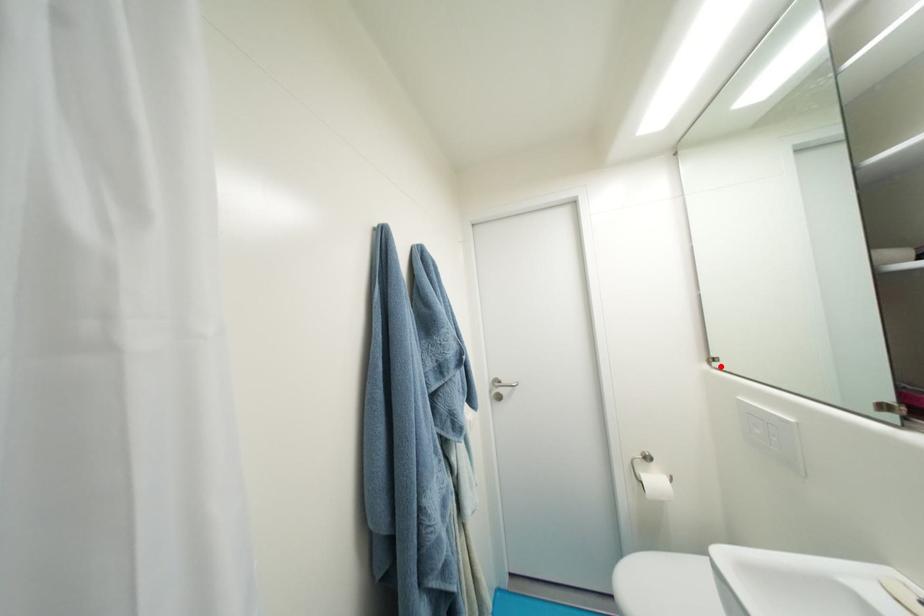
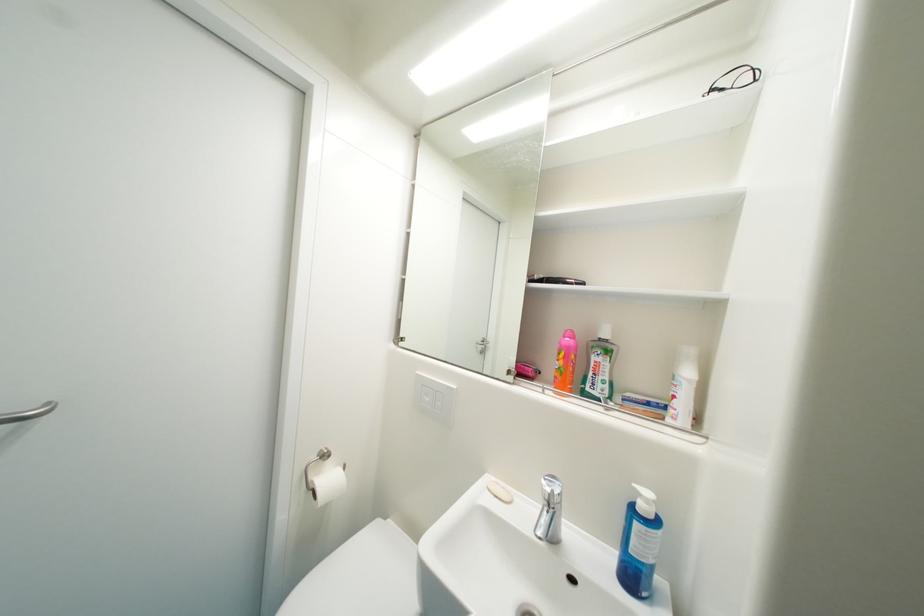
Find the pixel in the second image that matches the highlighted location in the first image.

(407, 345)